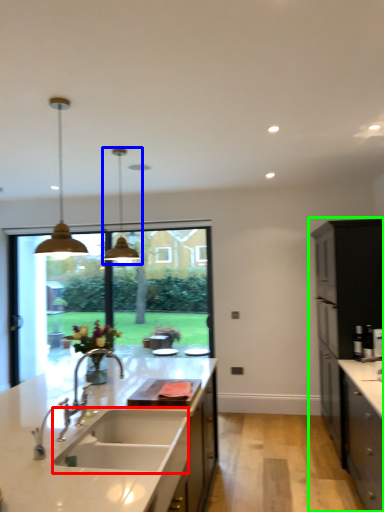
Question: Which object is positioned farthest from sink (highlighted by a red box)? Select from light fixture (highlighted by a blue box) and cabinetry (highlighted by a green box).

Choices:
 (A) light fixture
 (B) cabinetry

Answer: (B)